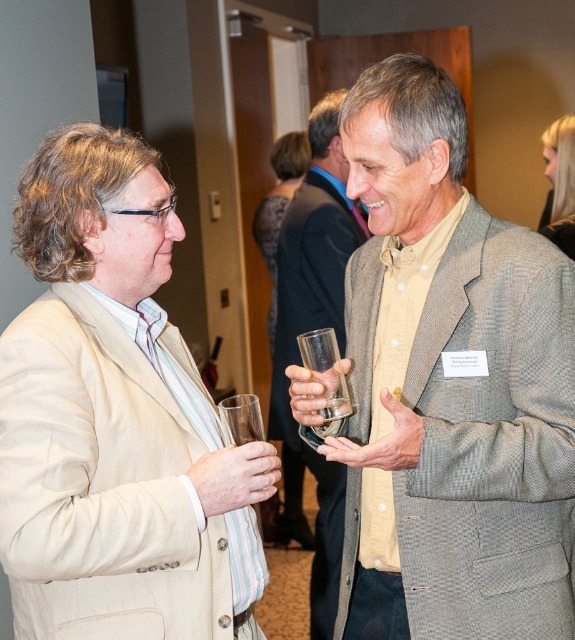
Which is below, beige fabric suit at left or dark gray textured dress at center?

beige fabric suit at left is lower down.

Can you confirm if beige fabric suit at left is shorter than dark gray textured dress at center?

Indeed, beige fabric suit at left has a lesser height compared to dark gray textured dress at center.

Which is behind, point (63, 228) or point (301, 524)?

Point (301, 524)

Where is `beige fabric suit at left`? This screenshot has height=640, width=575. beige fabric suit at left is located at coordinates (116, 419).

Can you confirm if light gray textured coat at upper right is wider than transparent glass at center?

Indeed, light gray textured coat at upper right has a greater width compared to transparent glass at center.

Is light gray textured coat at upper right shorter than transparent glass at center?

No.

Who is more distant from viewer, (561, 132) or (327, 384)?

Point (561, 132)

The width and height of the screenshot is (575, 640). In order to click on light gray textured coat at upper right in this screenshot , I will do `click(559, 182)`.

Between matte glass at center and transparent glass at left, which one is positioned lower?

transparent glass at left is below.

The width and height of the screenshot is (575, 640). In order to click on matte glass at center in this screenshot , I will do `click(316, 328)`.

Between point (350, 228) and point (246, 403), which one is positioned behind?

Point (350, 228)

This screenshot has height=640, width=575. Identify the location of matte glass at center. (316, 328).